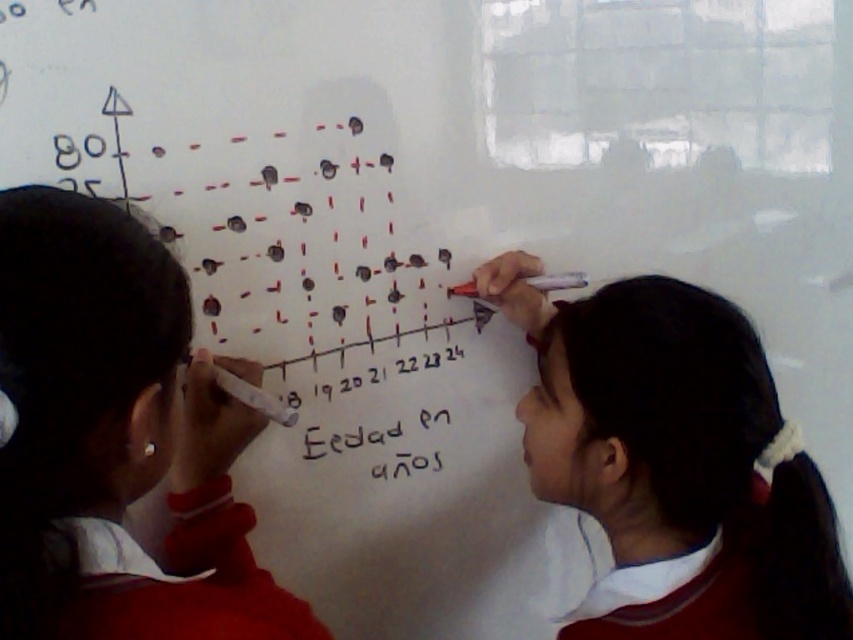
You are a student in the classroom and need to determine which object takes up more space on the whiteboard. Which one is larger between the white uniform at left and the white matte marker at upper right?

The white matte marker at upper right takes up more space than the white uniform at left because the white uniform at left occupies less space than the white matte marker at upper right.

You are standing in front of the whiteboard in the classroom scene. You need to reach the point labeled as point [62,298] on the board to make a correction. If your arm can extend 24 inches, will you be able to reach that point without moving closer?

The point [62,298] is 24.49 inches away from the camera. Since your arm can only extend 24 inches, you will not be able to reach it without moving closer.